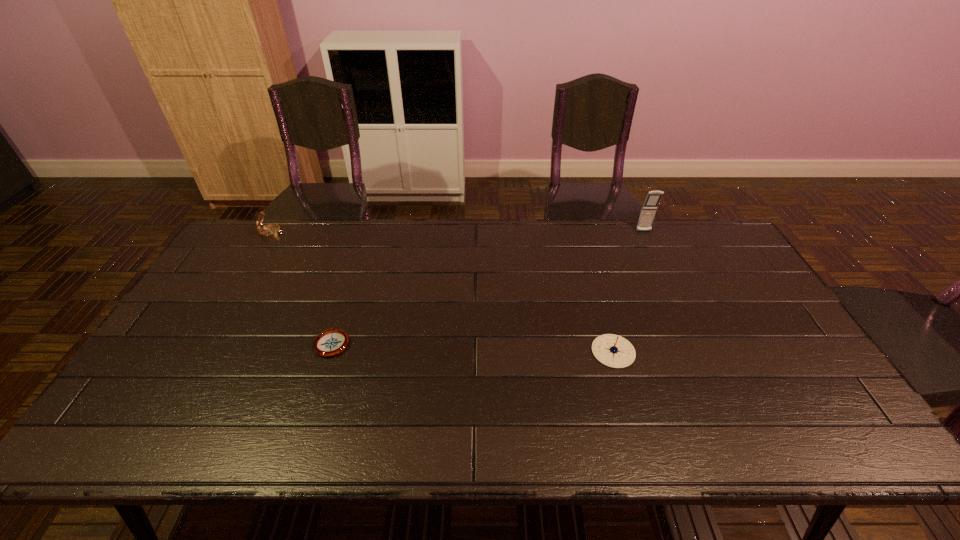
At what (x,y) coordinates should I click in order to perform the action: click on vacant space that is in between the tallest compass and the shortest object. Please return your answer as a coordinate pair (x, y). The width and height of the screenshot is (960, 540). Looking at the image, I should click on (302, 288).

You are a GUI agent. You are given a task and a screenshot of the screen. Output one action in this format:
    pyautogui.click(x=<x>, y=<y>)
    Task: Click on the closest object to the rightmost object
    The image size is (960, 540).
    Given the screenshot: What is the action you would take?
    click(x=614, y=351)

Choose which object is the second nearest neighbor to the cellular telephone. Please provide its 2D coordinates. Your answer should be formatted as a tuple, i.e. [(x, y)], where the tuple contains the x and y coordinates of a point satisfying the conditions above.

[(331, 342)]

Select which compass is the closest to the second object from left to right. Please provide its 2D coordinates. Your answer should be formatted as a tuple, i.e. [(x, y)], where the tuple contains the x and y coordinates of a point satisfying the conditions above.

[(269, 231)]

Locate an element on the screen. This screenshot has width=960, height=540. compass that is the nearest to the second tallest object is located at coordinates (331, 342).

Find the location of a particular element. The image size is (960, 540). vacant region that satisfies the following two spatial constraints: 1. on the front-facing side of the cellular telephone; 2. with the dial facing the third shortest object is located at coordinates (644, 233).

You are a GUI agent. You are given a task and a screenshot of the screen. Output one action in this format:
    pyautogui.click(x=<x>, y=<y>)
    Task: Click on the vacant area that satisfies the following two spatial constraints: 1. with the dial facing the third object from left to right; 2. on the left side of the tallest compass
    The width and height of the screenshot is (960, 540).
    Given the screenshot: What is the action you would take?
    pyautogui.click(x=203, y=352)

Where is `vacant space that satisfies the following two spatial constraints: 1. with the dial facing the leftmost object; 2. on the right side of the shortest compass`? Image resolution: width=960 pixels, height=540 pixels. vacant space that satisfies the following two spatial constraints: 1. with the dial facing the leftmost object; 2. on the right side of the shortest compass is located at coordinates (208, 342).

The image size is (960, 540). Find the location of `vacant region that satisfies the following two spatial constraints: 1. with the dial facing the second compass from left to right; 2. on the right side of the third shortest object`. vacant region that satisfies the following two spatial constraints: 1. with the dial facing the second compass from left to right; 2. on the right side of the third shortest object is located at coordinates (208, 342).

Find the location of a particular element. Image resolution: width=960 pixels, height=540 pixels. free space that satisfies the following two spatial constraints: 1. on the front-facing side of the tallest object; 2. with the dial facing the farthest compass is located at coordinates (644, 233).